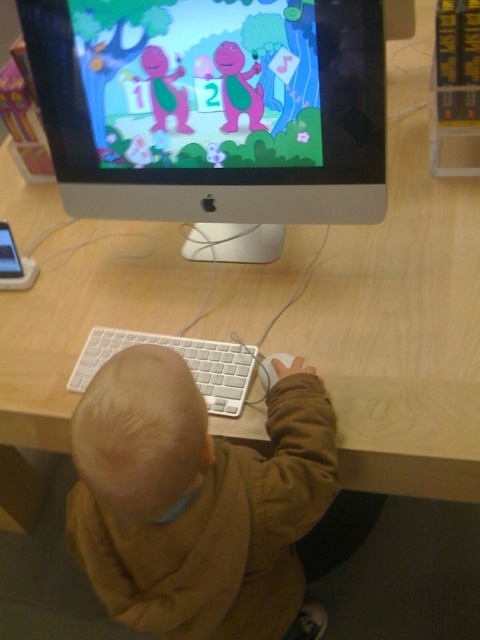
Between point (98, 332) and point (264, 380), which one is positioned in front?

Point (264, 380) is more forward.

Is white plastic keyboard at center wider than white plastic mouse at center?

Correct, the width of white plastic keyboard at center exceeds that of white plastic mouse at center.

Does point (228, 396) lie in front of point (282, 362)?

That is False.

Locate an element on the screen. Image resolution: width=480 pixels, height=640 pixels. white plastic keyboard at center is located at coordinates (184, 360).

Locate an element on the screen. white plastic monitor at upper center is located at coordinates [214, 109].

Identify the location of white plastic monitor at upper center. [214, 109].

Who is more forward, (283, 456) or (284, 353)?

Point (283, 456) is in front.

Between brown cotton hoodie at lower center and white plastic mouse at center, which one is positioned lower?

Positioned lower is brown cotton hoodie at lower center.

Is point (255, 550) positioned after point (285, 358)?

No, (255, 550) is in front of (285, 358).

This screenshot has width=480, height=640. I want to click on brown cotton hoodie at lower center, so click(195, 499).